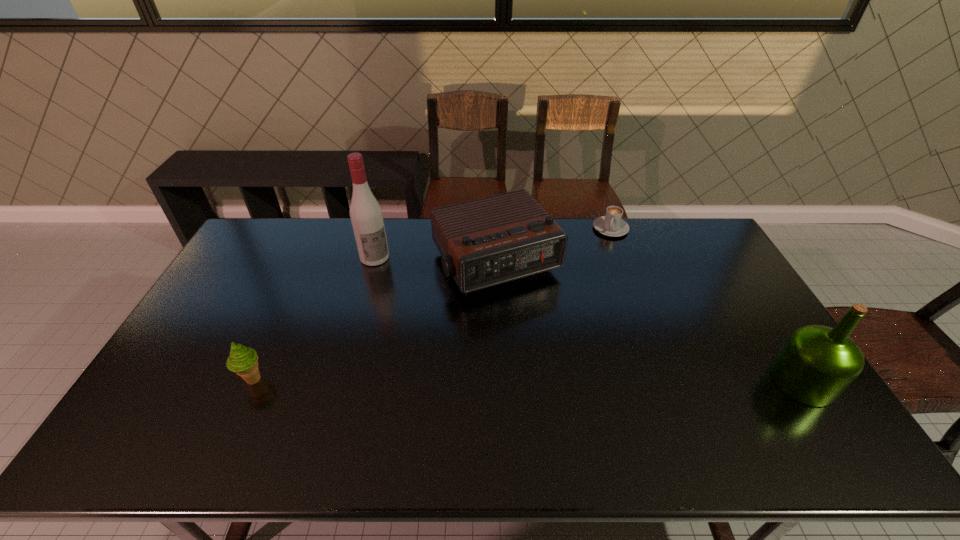
Identify the location of free space at the left edge. (217, 333).

Where is `free space at the far left corner of the desktop`? The width and height of the screenshot is (960, 540). free space at the far left corner of the desktop is located at coordinates pos(261,247).

This screenshot has height=540, width=960. Find the location of `vacant space at the far right corner of the desktop`. vacant space at the far right corner of the desktop is located at coordinates (676, 220).

The image size is (960, 540). I want to click on free space between the leftmost object and the fourth object from right to left, so click(x=314, y=319).

The image size is (960, 540). Identify the location of unoccupied position between the olive oil and the third object from left to right. (649, 321).

At what (x,y) coordinates should I click in order to perform the action: click on free space between the radio receiver and the second object from left to right. Please return your answer as a coordinate pair (x, y). The height and width of the screenshot is (540, 960). Looking at the image, I should click on [x=435, y=260].

Locate an element on the screen. The image size is (960, 540). vacant region between the second object from right to left and the icecream is located at coordinates (432, 304).

I want to click on vacant area between the icecream and the third shortest object, so click(x=374, y=321).

Locate an element on the screen. The width and height of the screenshot is (960, 540). vacant space that is in between the fourth object from right to left and the third tallest object is located at coordinates (435, 260).

Find the location of a particular element. This screenshot has height=540, width=960. object that is the second closest to the fourth object from left to right is located at coordinates (817, 363).